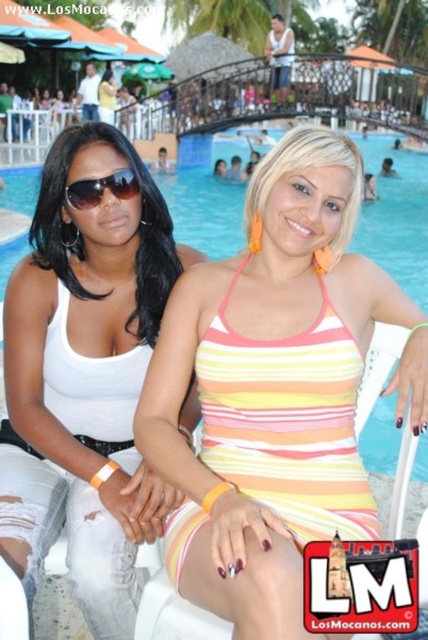
You are a lifeguard who needs to quickly identify the location of the striped fabric swimsuit at center and the matte black sunglasses at left. Which object is positioned further to the left in the image?

The matte black sunglasses at left is positioned further to the left compared to the striped fabric swimsuit at center.

You are a photographer at the poolside and want to capture a shot of the white matte tank top at center and the matte black sunglasses at left. Based on their positions, which object should you focus on first if you want to ensure both are in frame without moving the camera?

The white matte tank top at center is located below the matte black sunglasses at left, so you should focus on the matte black sunglasses at left first to ensure both are in frame without moving the camera.

You are a photographer trying to capture a candid shot of the two women at the poolside. You want to ensure that both the striped fabric swimsuit at center and the white matte tank top at center are clearly visible in the frame. Given their sizes, which clothing item will require you to adjust your camera angle to avoid cropping it out?

The striped fabric swimsuit at center has a larger width than the white matte tank top at center, so it will require adjusting the camera angle to ensure it fits entirely within the frame without being cropped.